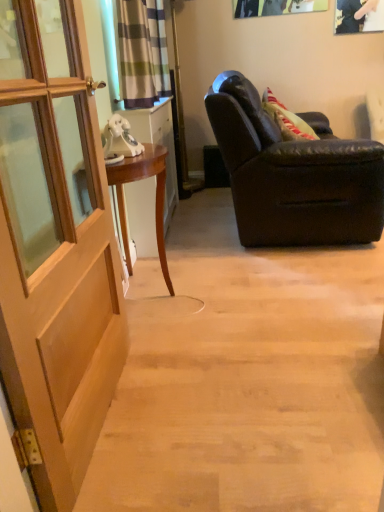
This screenshot has height=512, width=384. In order to click on vacant space in front of mahogany wood desk at left in this screenshot , I will do `click(182, 346)`.